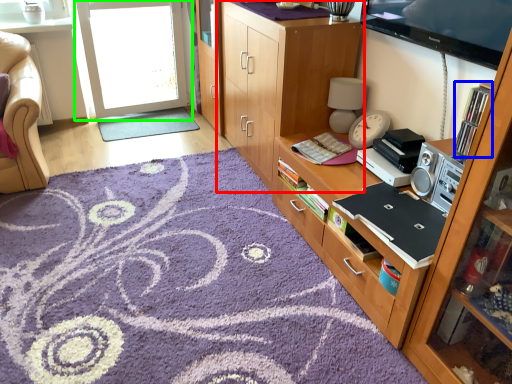
Question: Which object is the closest to the cabinetry (highlighted by a red box)? Choose among these: shelf (highlighted by a blue box) or screen door (highlighted by a green box).

Choices:
 (A) shelf
 (B) screen door

Answer: (A)